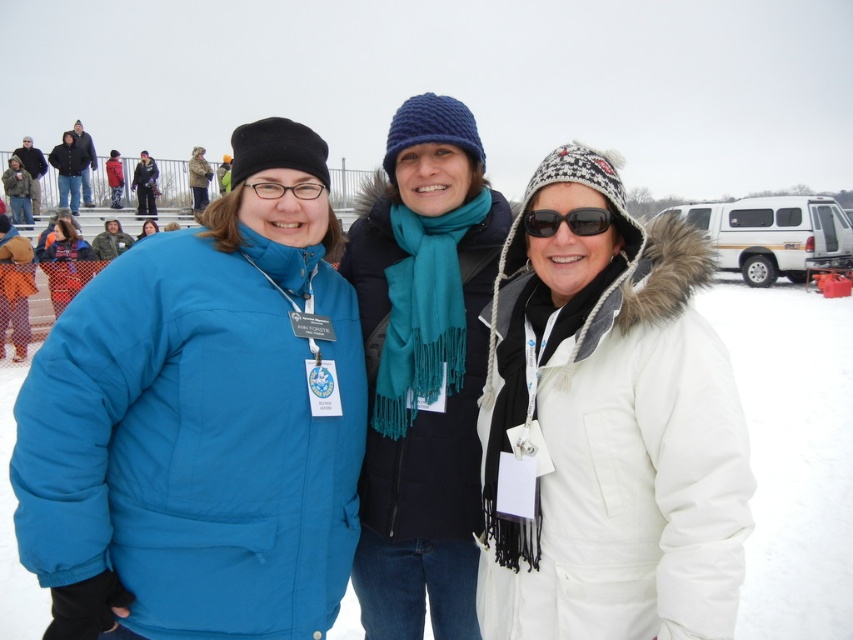
Question: Can you confirm if matte black glasses at center is wider than blue fleece jacket at center?

Choices:
 (A) yes
 (B) no

Answer: (A)

Question: Which point is farther from the camera taking this photo?

Choices:
 (A) (56, 305)
 (B) (320, 420)
 (C) (303, 182)
 (D) (729, 628)

Answer: (A)

Question: Can you confirm if black reflective sunglasses at center is wider than matte black glasses at center?

Choices:
 (A) yes
 (B) no

Answer: (B)

Question: Can you confirm if knitted blue hat at center is smaller than matte black glasses at center?

Choices:
 (A) yes
 (B) no

Answer: (B)

Question: Considering the real-world distances, which object is farthest from the matte blue jacket at lower left?

Choices:
 (A) blue fleece jacket at center
 (B) black reflective sunglasses at center

Answer: (B)

Question: Which point appears farthest from the camera in this image?

Choices:
 (A) (408, 253)
 (B) (86, 259)
 (C) (143, 232)

Answer: (C)